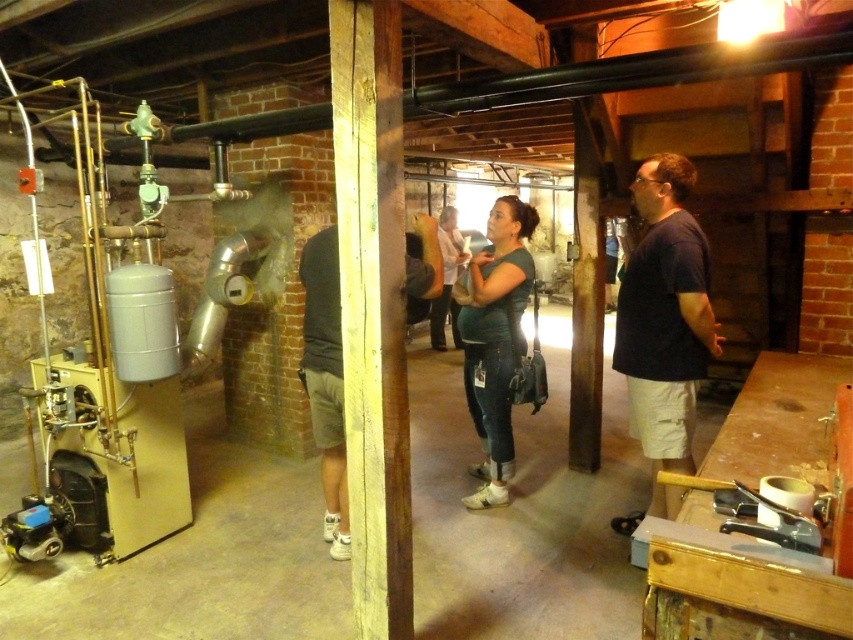
Question: Is dark blue t-shirt at right further to the viewer compared to dark green jersey at center?

Choices:
 (A) yes
 (B) no

Answer: (B)

Question: Which point is farther to the camera?

Choices:
 (A) (514, 269)
 (B) (402, 289)
 (C) (434, 324)

Answer: (C)

Question: Can you confirm if dark green jersey at center is positioned to the left of matte green shirt at center?

Choices:
 (A) yes
 (B) no

Answer: (B)

Question: Does dark blue t-shirt at right have a lesser width compared to dark gray fabric shorts at center?

Choices:
 (A) no
 (B) yes

Answer: (A)

Question: Considering the real-world distances, which object is farthest from the matte green shirt at center?

Choices:
 (A) dark blue t-shirt at right
 (B) dark green jersey at center
 (C) dark gray fabric shorts at center

Answer: (A)

Question: Which object appears closest to the camera in this image?

Choices:
 (A) dark gray fabric shorts at center
 (B) matte green shirt at center
 (C) dark blue t-shirt at right

Answer: (C)